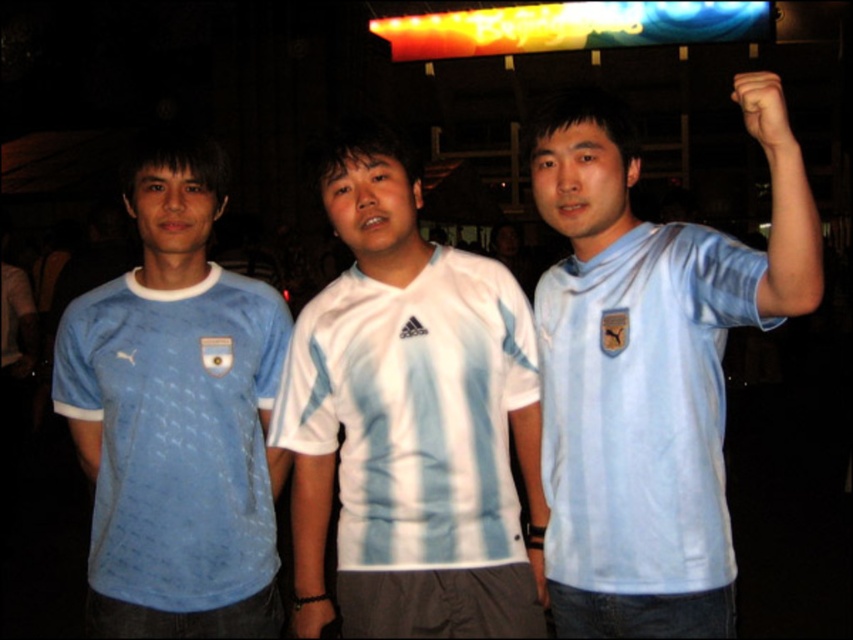
You are organizing a sports event and need to ensure that all participants have jerseys of the same width. You have two jerseys available for adjustments. The light blue jersey at center and the matte blue jersey at left. Which jersey should you adjust to match the other in width?

The light blue jersey at center has a smaller width than the matte blue jersey at left. To make them the same width, you should adjust the light blue jersey at center to be wider or reduce the width of the matte blue jersey at left.

You are a photographer trying to capture a clear shot of both the light blue jersey at center and the white matte jersey at center. Since you want to focus on the one that is closer to you, which one should you aim your camera at?

The light blue jersey at center is closer to the viewer than the white matte jersey at center, so you should aim your camera at the light blue jersey at center to focus on the one closer to you.

You are a photographer trying to capture a group photo of the light blue jersey at center and the white matte jersey at center. Since you want to highlight the height difference between them, which jersey should you position closer to the camera to emphasize its height advantage?

The light blue jersey at center is taller than the white matte jersey at center. To emphasize its height advantage, position the light blue jersey at center closer to the camera.